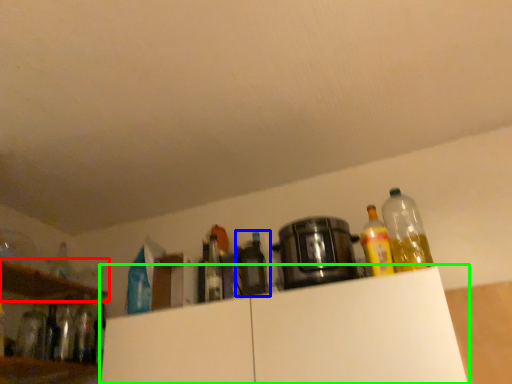
Question: Which object is the farthest from shelf (highlighted by a red box)? Choose among these: bottle (highlighted by a blue box) or cabinetry (highlighted by a green box).

Choices:
 (A) bottle
 (B) cabinetry

Answer: (A)